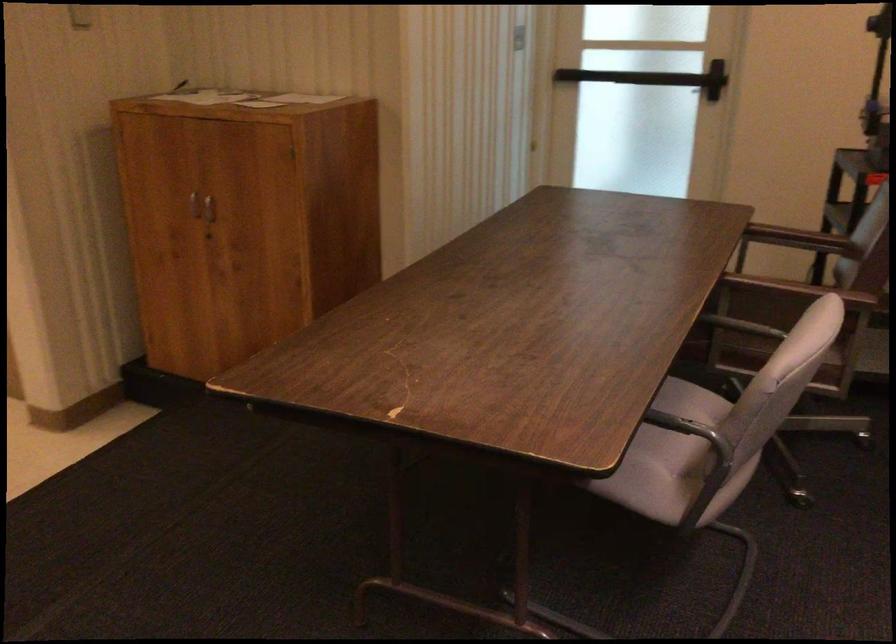
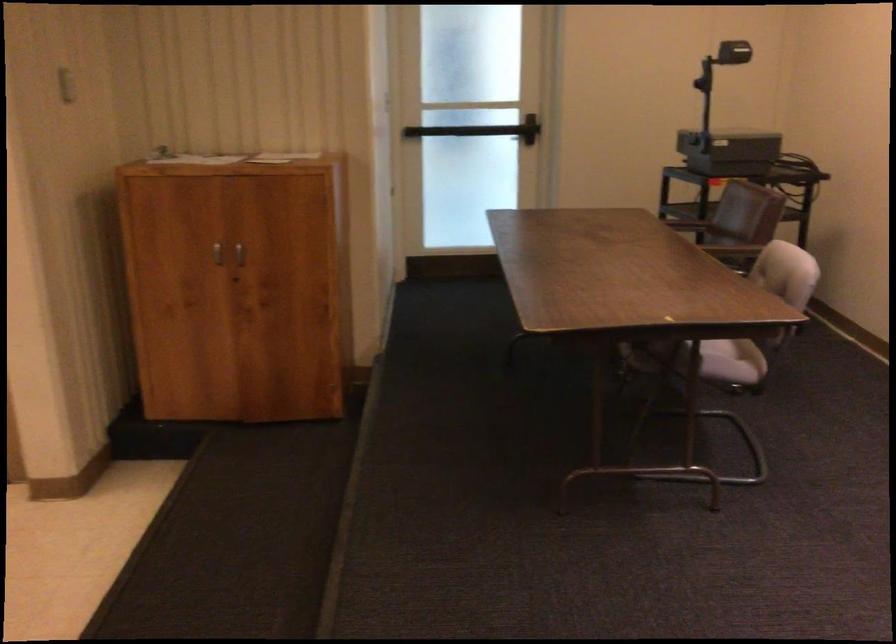
Find the pixel in the second image that matches point 186,205 in the first image.

(217, 252)